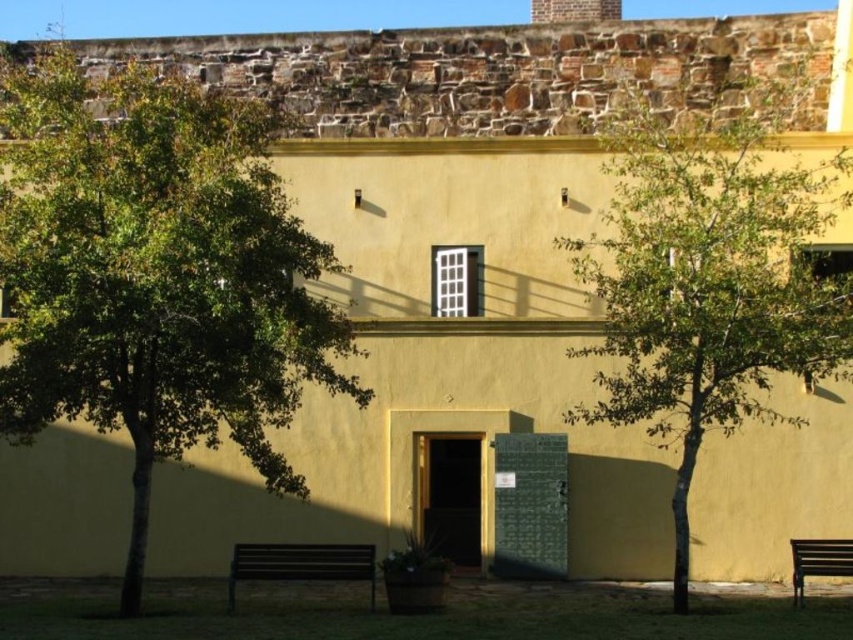
Question: Which of the following is the farthest from the observer?

Choices:
 (A) wooden park bench at lower right
 (B) brown wooden bench at lower center
 (C) green leafy tree at left

Answer: (A)

Question: Which object is the closest to the brown wooden bench at lower center?

Choices:
 (A) green leafy tree at center
 (B) green leafy tree at left

Answer: (B)

Question: Which point appears farthest from the camera in this image?

Choices:
 (A) (819, 557)
 (B) (9, 416)

Answer: (A)

Question: Where is brown wooden bench at lower center located in relation to wooden park bench at lower right in the image?

Choices:
 (A) left
 (B) right

Answer: (A)

Question: Is brown wooden bench at lower center to the right of wooden park bench at lower right from the viewer's perspective?

Choices:
 (A) yes
 (B) no

Answer: (B)

Question: Can you confirm if green leafy tree at center is positioned to the left of brown wooden bench at lower center?

Choices:
 (A) yes
 (B) no

Answer: (B)